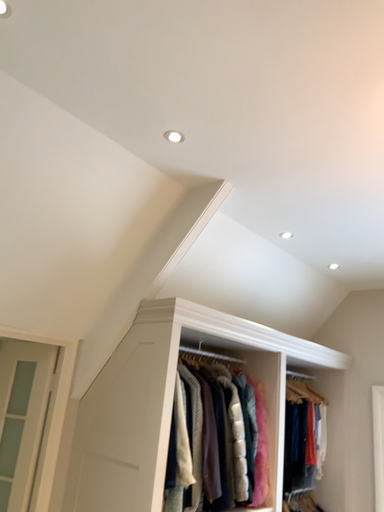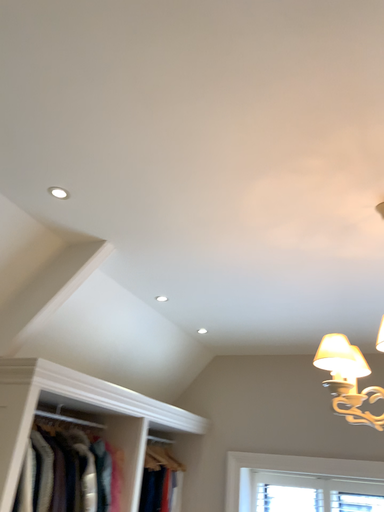
Question: Which way did the camera rotate in the video?

Choices:
 (A) rotated left
 (B) rotated right

Answer: (B)